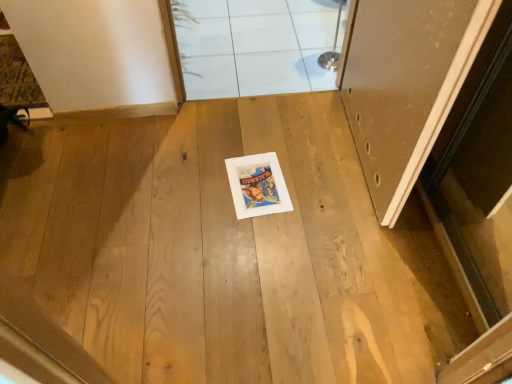
Question: Is white tile at upper center inside the boundaries of matte white door at right, or outside?

Choices:
 (A) inside
 (B) outside

Answer: (B)

Question: From a real-world perspective, relative to matte white door at right, is white tile at upper center vertically above or below?

Choices:
 (A) below
 (B) above

Answer: (A)

Question: Which object is the closest to the matte white door at right?

Choices:
 (A) white tile at upper center
 (B) white glossy tile at upper center

Answer: (A)

Question: Which object is positioned farthest from the matte white door at right?

Choices:
 (A) white glossy tile at upper center
 (B) white tile at upper center

Answer: (A)